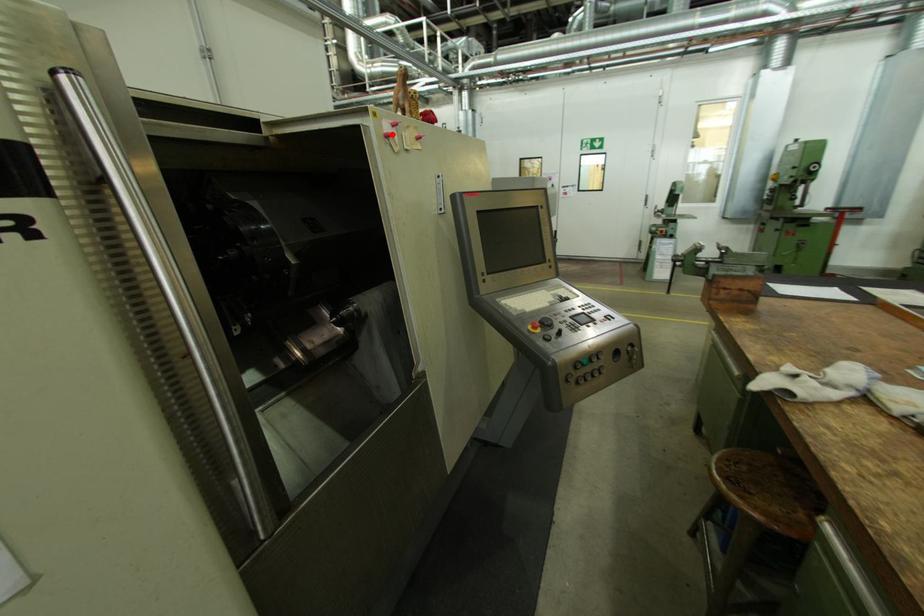
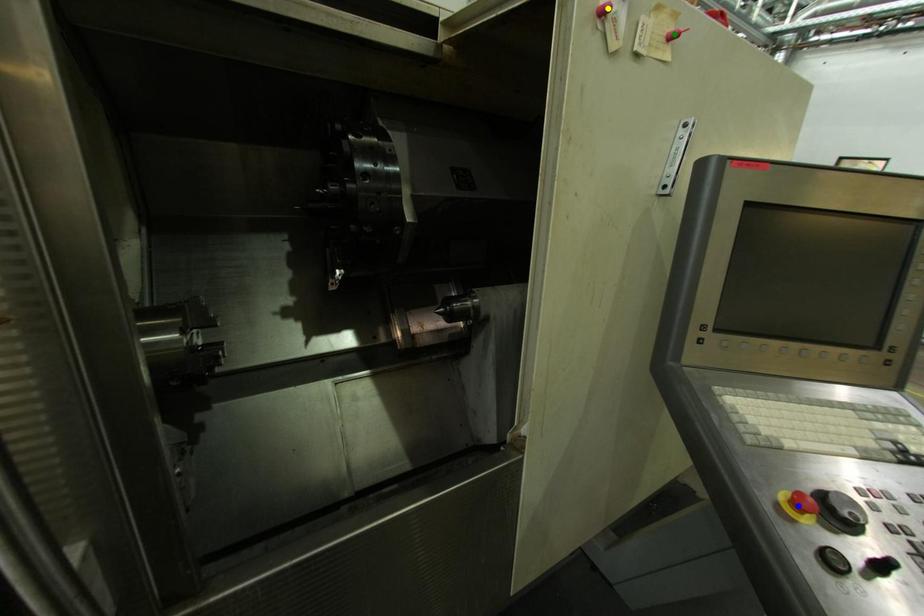
Question: I am providing you with two images of the same scene from different viewpoints. A red point is marked on the first image. You are given multiple points on the second image. In image 2, which mark is for the same physical point as the one in image 1?

Choices:
 (A) yellow point
 (B) green point
 (C) blue point

Answer: (A)